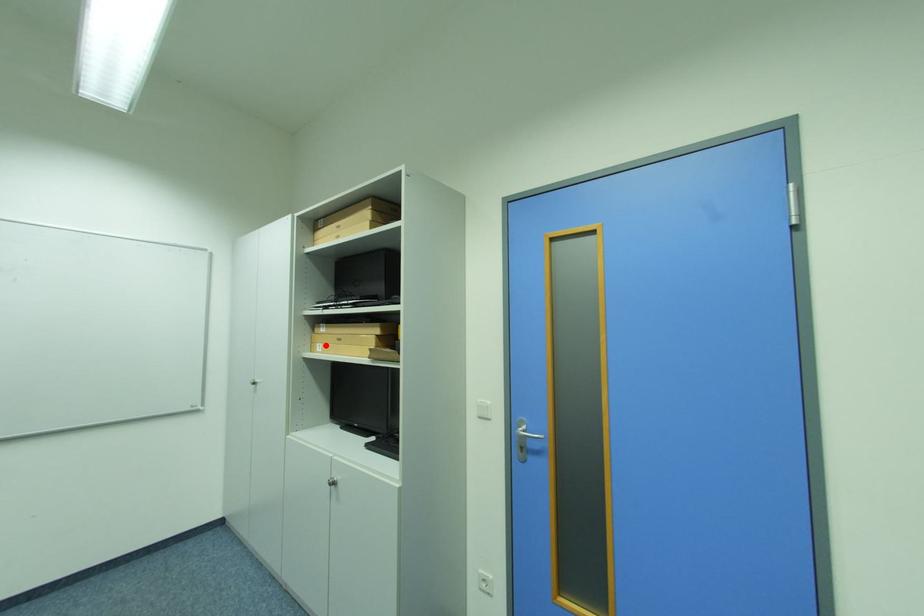
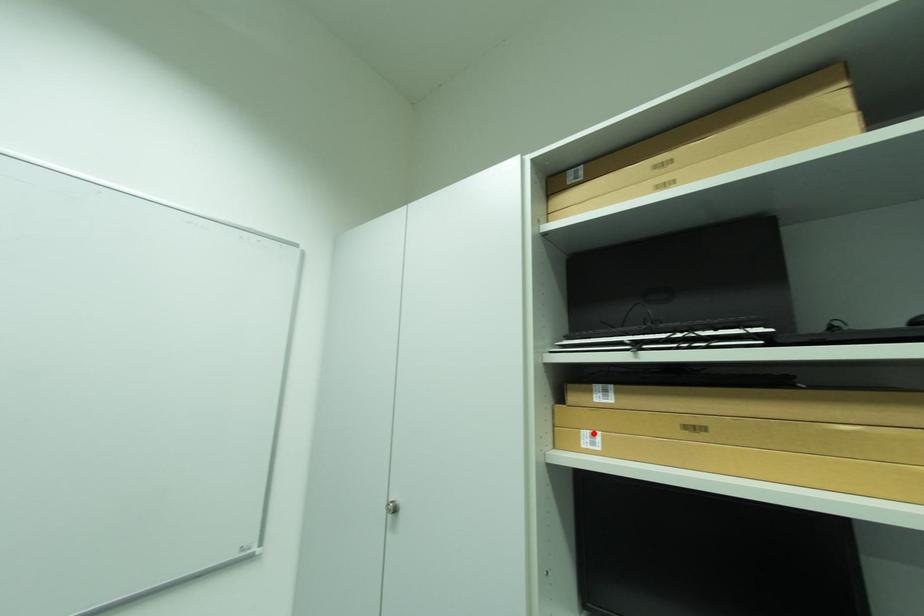
I am providing you with two images of the same scene from different viewpoints. A red point is marked on the first image and another point is marked on the second image. Does the point marked in image1 correspond to the same location as the one in image2?

Yes